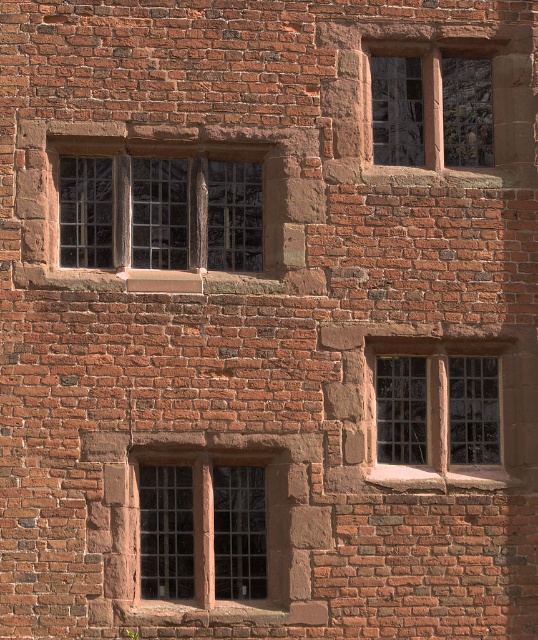
The width and height of the screenshot is (538, 640). What do you see at coordinates (208, 522) in the screenshot?
I see `clear glass window at center` at bounding box center [208, 522].

How distant is clear glass window at center from stone textured window at lower right?

clear glass window at center and stone textured window at lower right are 3.48 feet apart from each other.

Identify the location of clear glass window at center. (208, 522).

Does clear glass window at upper center have a greater height compared to stone textured window at lower right?

In fact, clear glass window at upper center may be shorter than stone textured window at lower right.

Does point (100, 195) lie in front of point (410, 417)?

Yes, it is in front of point (410, 417).

Describe the element at coordinates (165, 209) in the screenshot. I see `clear glass window at upper center` at that location.

Image resolution: width=538 pixels, height=640 pixels. Identify the location of clear glass window at upper center. (165, 209).

Who is higher up, clear glass window at upper center or clear glass window at center?

clear glass window at upper center is above.

Based on the photo, is clear glass window at upper center wider than clear glass window at center?

Yes, clear glass window at upper center is wider than clear glass window at center.

Does point (186, 250) come farther from viewer compared to point (161, 580)?

That is True.

Identify the location of clear glass window at upper center. (165, 209).